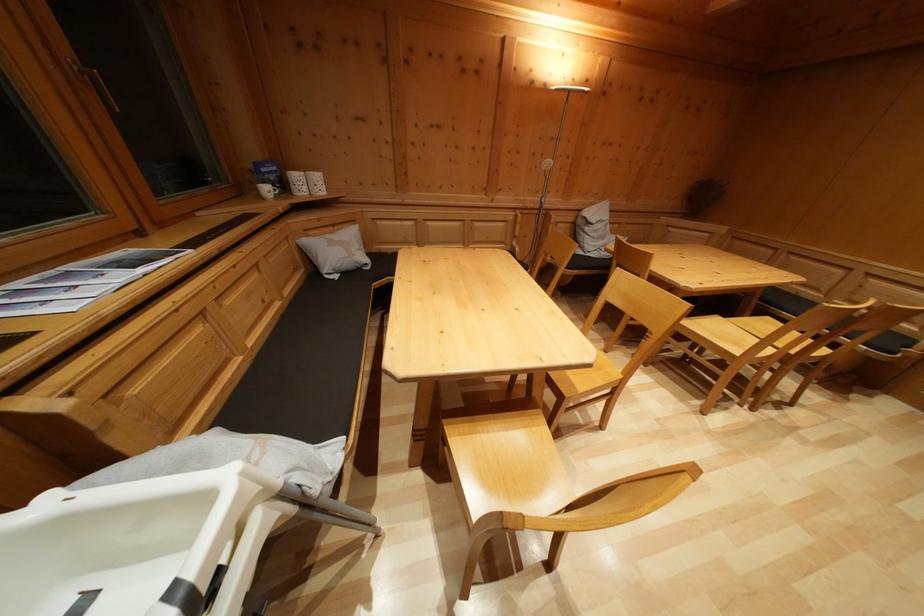
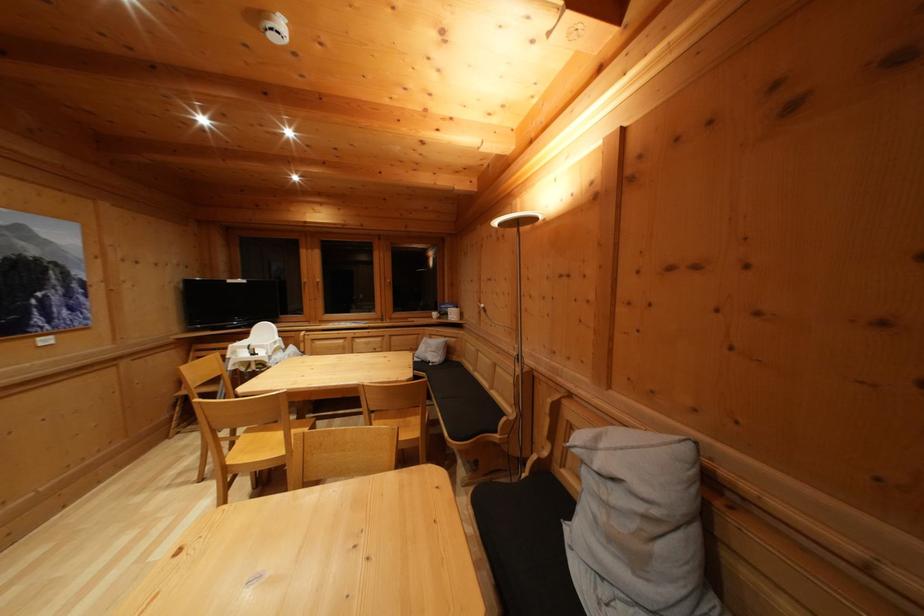
The point at (268,171) is marked in the first image. Where is the corresponding point in the second image?

(450, 310)